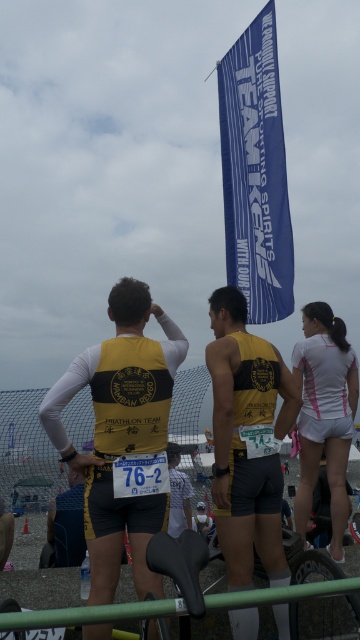
Based on the photo, you are a participant in the triathlon event and need to locate your team member wearing a yellow matte vest at center. You see another participant wearing a yellow fabric vest at center. Which one is positioned to the right of the other?

The yellow matte vest at center is positioned to the right of the yellow fabric vest at center.

You are a photographer positioned at the back of the scene. You need to take a photo of both the yellow matte triathlon suit at center and the white matte shorts at right. Which one will appear larger in your photo?

The yellow matte triathlon suit at center will appear larger in the photo because it is closer to the viewer than the white matte shorts at right.